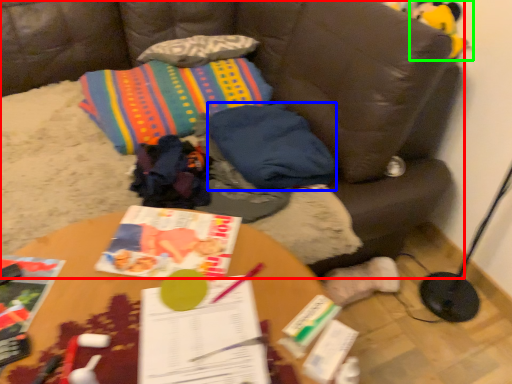
Question: Which object is positioned closest to studio couch (highlighted by a red box)? Select from pillow (highlighted by a blue box) and toy (highlighted by a green box).

Choices:
 (A) pillow
 (B) toy

Answer: (A)